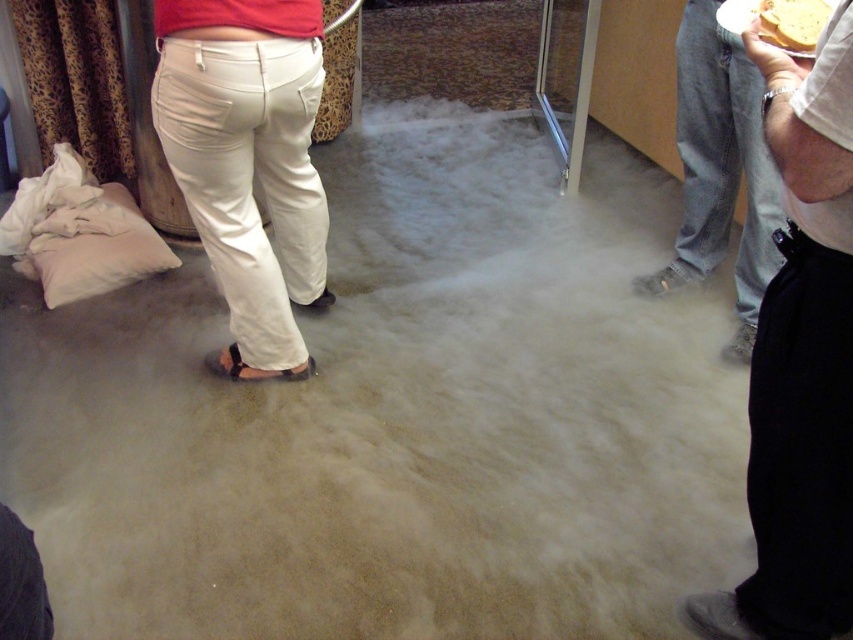
Question: Is white cotton pants at lower left smaller than denim jeans at right?

Choices:
 (A) yes
 (B) no

Answer: (A)

Question: Estimate the real-world distances between objects in this image. Which object is farther from the black suede sandal at lower center?

Choices:
 (A) white cotton pants at lower left
 (B) beige fabric pillow at left

Answer: (B)

Question: Can you confirm if denim jeans at right is positioned to the right of beige fabric pillow at left?

Choices:
 (A) no
 (B) yes

Answer: (B)

Question: Considering the real-world distances, which object is farthest from the yellow bread at upper right?

Choices:
 (A) black smooth pants at right
 (B) denim jeans at right
 (C) white cotton pants at lower left

Answer: (C)

Question: Can you confirm if black smooth pants at right is thinner than black suede sandal at lower center?

Choices:
 (A) yes
 (B) no

Answer: (B)

Question: Which of the following is the farthest from the observer?

Choices:
 (A) (270, 372)
 (B) (126, 276)
 (C) (724, 49)
 (D) (811, 486)

Answer: (B)